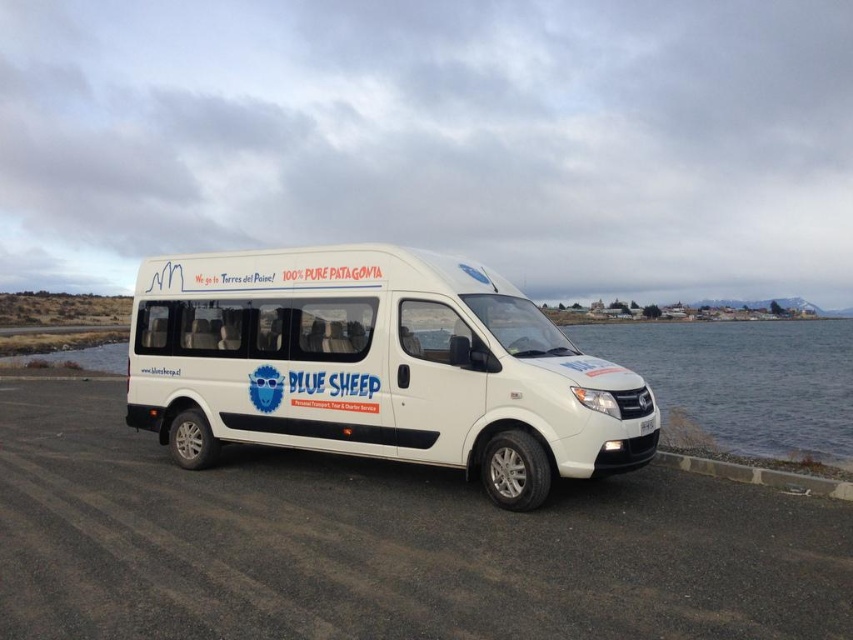
Between white matte van at center and gray concrete curb at lower right, which one has less height?

Standing shorter between the two is gray concrete curb at lower right.

Where is `white matte van at center`? white matte van at center is located at coordinates (376, 368).

Identify the location of white matte van at center. (376, 368).

Between transparent glass water at lower right and gray concrete curb at lower right, which one is positioned higher?

transparent glass water at lower right is higher up.

Who is lower down, transparent glass water at lower right or gray concrete curb at lower right?

Positioned lower is gray concrete curb at lower right.

Is point (757, 369) positioned before point (772, 472)?

No, it is behind (772, 472).

Find the location of a particular element. This screenshot has width=853, height=640. transparent glass water at lower right is located at coordinates (741, 385).

Is point (230, 340) farther from camera compared to point (744, 356)?

That is False.

Who is more distant from viewer, (196, 448) or (764, 333)?

Positioned behind is point (764, 333).

Where is `white matte van at center`? white matte van at center is located at coordinates (376, 368).